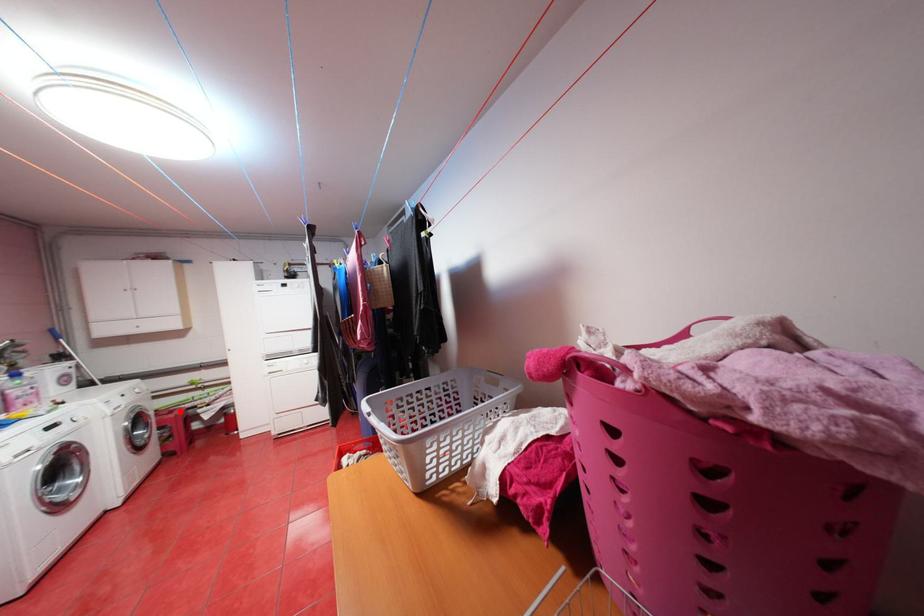
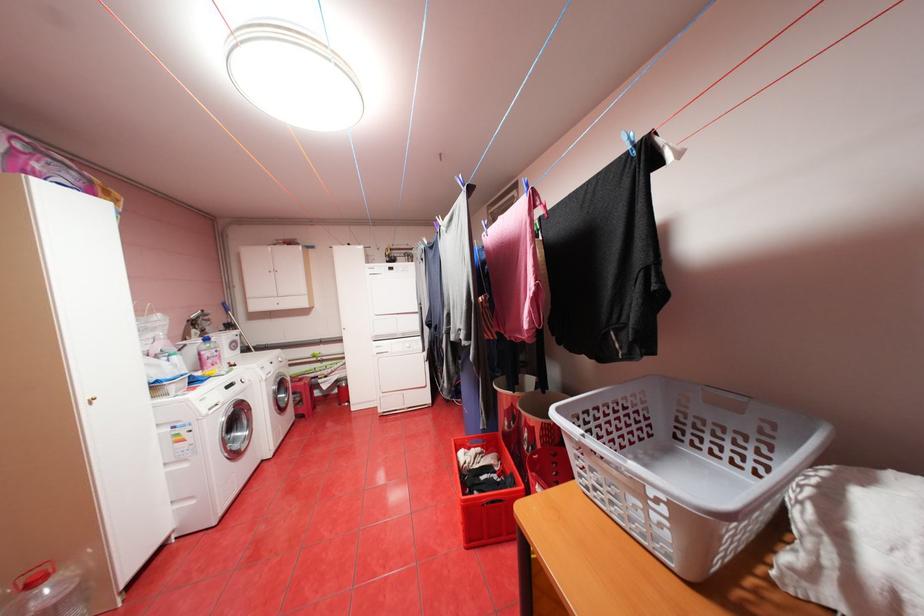
Question: A red point is marked in image1. In image2, is the corresponding 3D point closer to the camera or farther? Reply with the corresponding letter.

Choices:
 (A) The corresponding 3D point is closer.
 (B) The corresponding 3D point is farther.

Answer: (B)